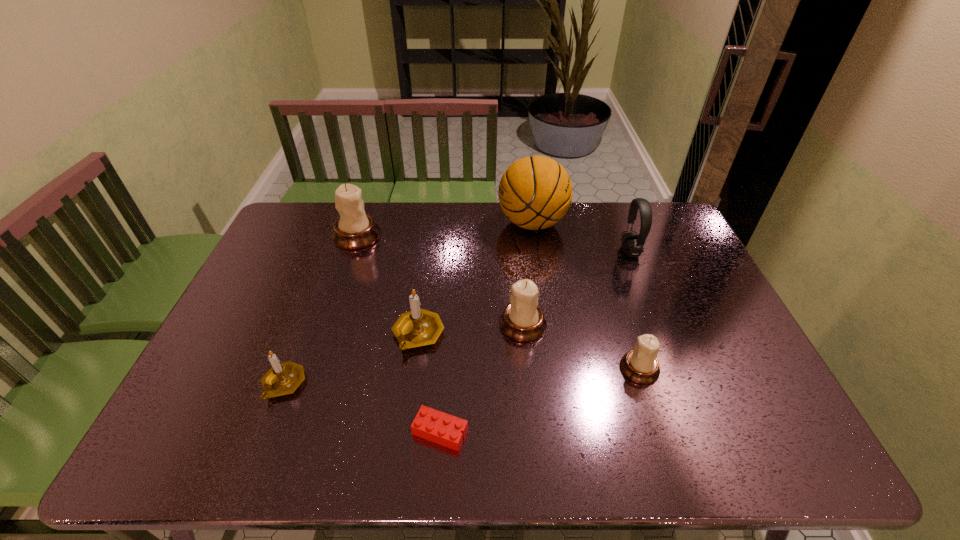
At what (x,y) coordinates should I click in order to perform the action: click on object that is at the near edge. Please return your answer as a coordinate pair (x, y). Looking at the image, I should click on (430, 424).

This screenshot has height=540, width=960. Identify the location of vacant area at the far edge of the desktop. (459, 230).

In the image, there is a desktop. Where is `vacant space at the left edge`? This screenshot has width=960, height=540. vacant space at the left edge is located at coordinates (286, 275).

I want to click on vacant space at the right edge of the desktop, so click(718, 363).

Where is `free spot at the far right corner of the desktop`? The image size is (960, 540). free spot at the far right corner of the desktop is located at coordinates (683, 233).

The image size is (960, 540). In order to click on free area in between the biggest white candle holder and the second white candle holder from right to left in this screenshot , I will do `click(440, 280)`.

Where is `free space between the smaller gold candle holder and the tallest object`? free space between the smaller gold candle holder and the tallest object is located at coordinates (408, 303).

The width and height of the screenshot is (960, 540). I want to click on free spot between the second smallest white candle holder and the nearest white candle holder, so click(x=581, y=347).

Identify the location of free spot between the nearest object and the third candle holder from right to left. (429, 383).

This screenshot has width=960, height=540. In order to click on free spot between the headset and the Lego in this screenshot , I will do `click(535, 341)`.